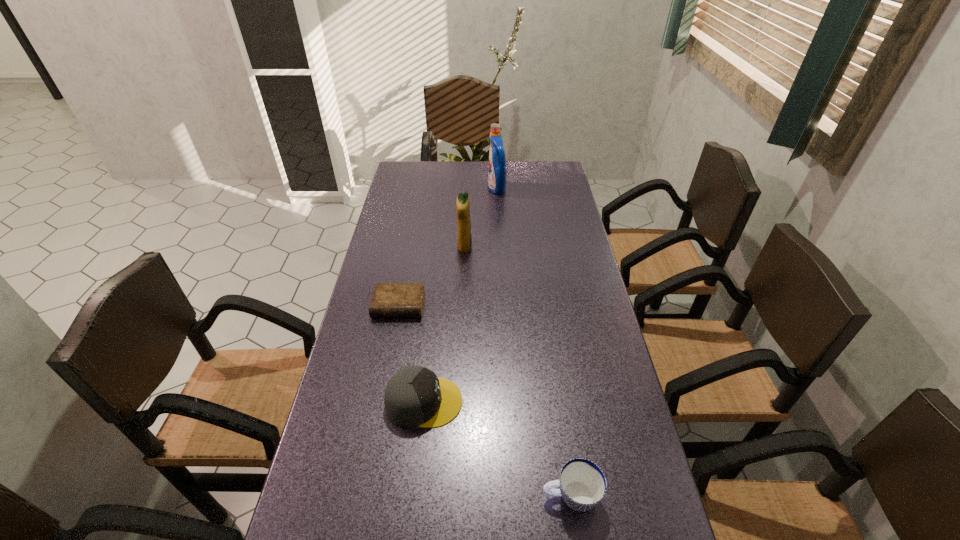
In order to click on the farther detergent in this screenshot , I will do (497, 162).

Find the location of a particular element. The image size is (960, 540). the fourth object from left to right is located at coordinates (497, 162).

The height and width of the screenshot is (540, 960). What are the coordinates of `the second farthest object` in the screenshot? It's located at (464, 241).

The image size is (960, 540). In order to click on the nearer detergent in this screenshot , I will do `click(464, 241)`.

The height and width of the screenshot is (540, 960). Identify the location of cap. (414, 396).

The image size is (960, 540). Find the location of `the rightmost object`. the rightmost object is located at coordinates (582, 483).

Identify the location of the fourth tallest object. The image size is (960, 540). (582, 483).

You are a GUI agent. You are given a task and a screenshot of the screen. Output one action in this format:
    pyautogui.click(x=<x>, y=<y>)
    Task: Click on the diary
    
    Given the screenshot: What is the action you would take?
    pyautogui.click(x=389, y=300)

Find the location of a particular element. Image resolution: width=960 pixels, height=540 pixels. the shortest object is located at coordinates (389, 300).

Locate an element on the screen. This screenshot has height=540, width=960. free region located 0.310m on the label of the fourth object from left to right is located at coordinates (413, 188).